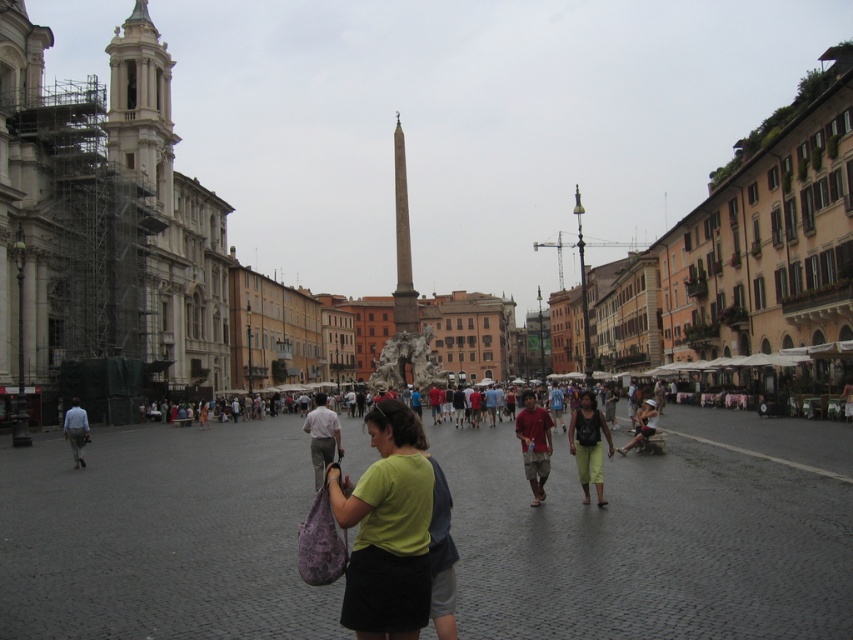
Can you confirm if green matte shirt at center is positioned to the left of matte red t-shirt at center?

Indeed, green matte shirt at center is positioned on the left side of matte red t-shirt at center.

Can you confirm if green matte shirt at center is positioned to the right of matte red t-shirt at center?

Incorrect, green matte shirt at center is not on the right side of matte red t-shirt at center.

Who is more distant from viewer, (418, 522) or (529, 394)?

The point (529, 394) is more distant.

This screenshot has width=853, height=640. What are the coordinates of `green matte shirt at center` in the screenshot? It's located at (387, 529).

Is green matte shirt at center closer to the viewer compared to light brown cotton shirt at center?

Yes.

Locate an element on the screen. green matte shirt at center is located at coordinates (387, 529).

Which is in front, point (387, 596) or point (322, 464)?

Point (387, 596)

Find the location of a particular element. Image resolution: width=853 pixels, height=640 pixels. green matte shirt at center is located at coordinates (387, 529).

Which is more to the left, light brown cotton shirt at center or matte black shirt at center?

From the viewer's perspective, light brown cotton shirt at center appears more on the left side.

Identify the location of light brown cotton shirt at center. (322, 436).

You are a GUI agent. You are given a task and a screenshot of the screen. Output one action in this format:
    pyautogui.click(x=<x>, y=<y>)
    Task: Click on the light brown cotton shirt at center
    The height and width of the screenshot is (640, 853).
    Given the screenshot: What is the action you would take?
    pyautogui.click(x=322, y=436)